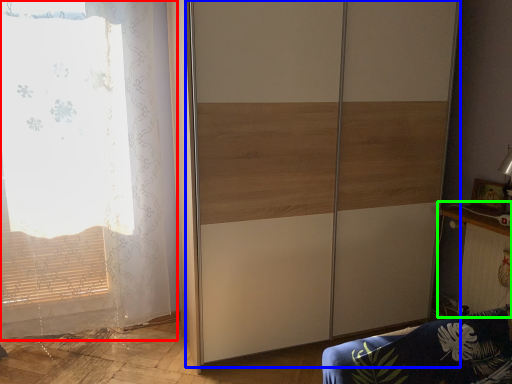
Question: Estimate the real-world distances between objects in this image. Which object is farther from curtain (highlighted by a red box), screen door (highlighted by a blue box) or table (highlighted by a green box)?

Choices:
 (A) screen door
 (B) table

Answer: (B)